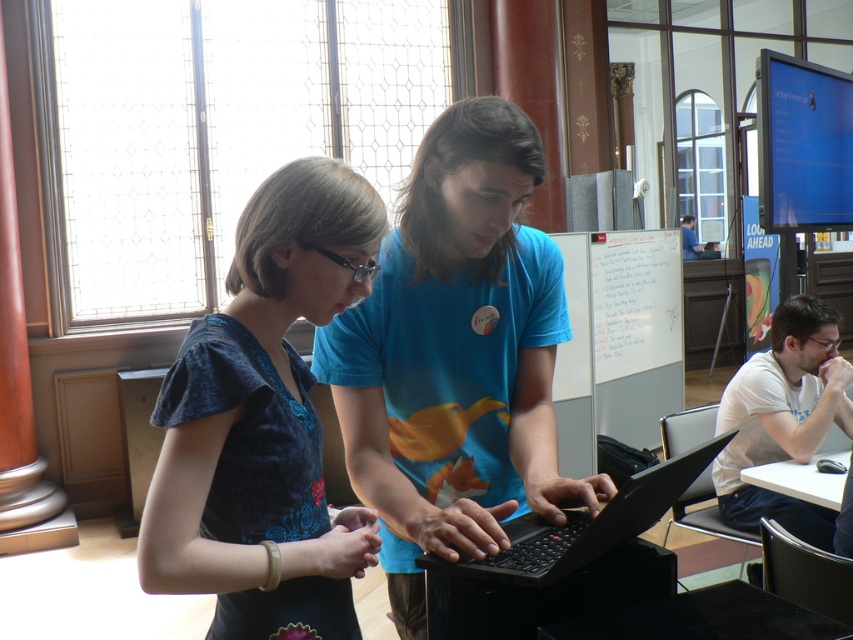
Question: Does velvet blue blouse at center have a larger size compared to whiteboard at center?

Choices:
 (A) yes
 (B) no

Answer: (B)

Question: Does blue matte shirt at center lie in front of whiteboard at center?

Choices:
 (A) no
 (B) yes

Answer: (B)

Question: Among these objects, which one is farthest from the camera?

Choices:
 (A) black matte laptop at center
 (B) whiteboard at center

Answer: (B)

Question: Which is nearer to the blue matte shirt at center?

Choices:
 (A) black matte laptop at center
 (B) velvet blue blouse at center
 (C) whiteboard at center

Answer: (B)

Question: Which point is closer to the camera?

Choices:
 (A) (682, 490)
 (B) (483, 120)

Answer: (A)

Question: Is the position of blue matte shirt at center less distant than that of black matte laptop at center?

Choices:
 (A) yes
 (B) no

Answer: (B)